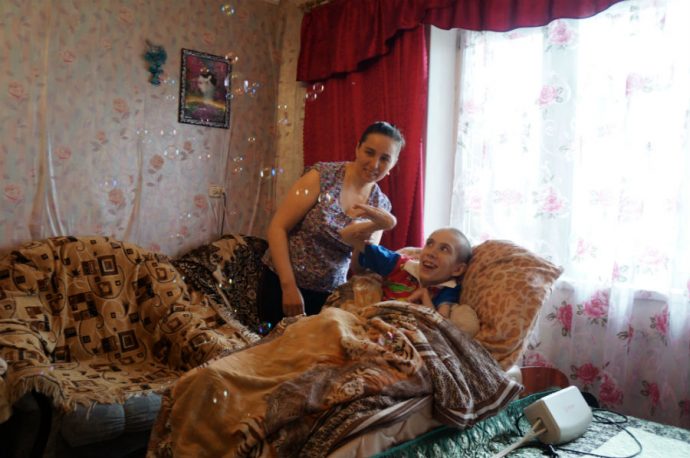
Locate an element on the screen. The image size is (690, 458). valance is located at coordinates (335, 15).